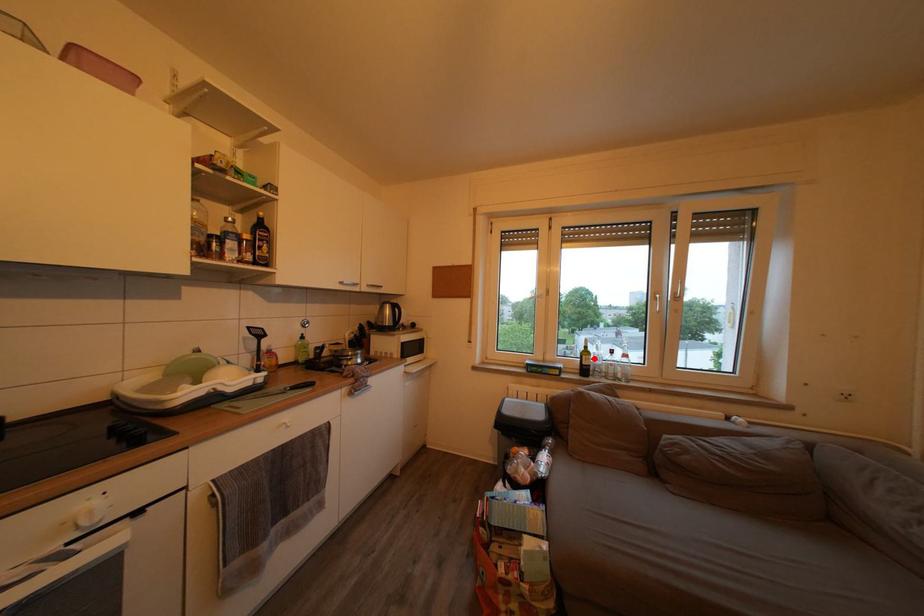
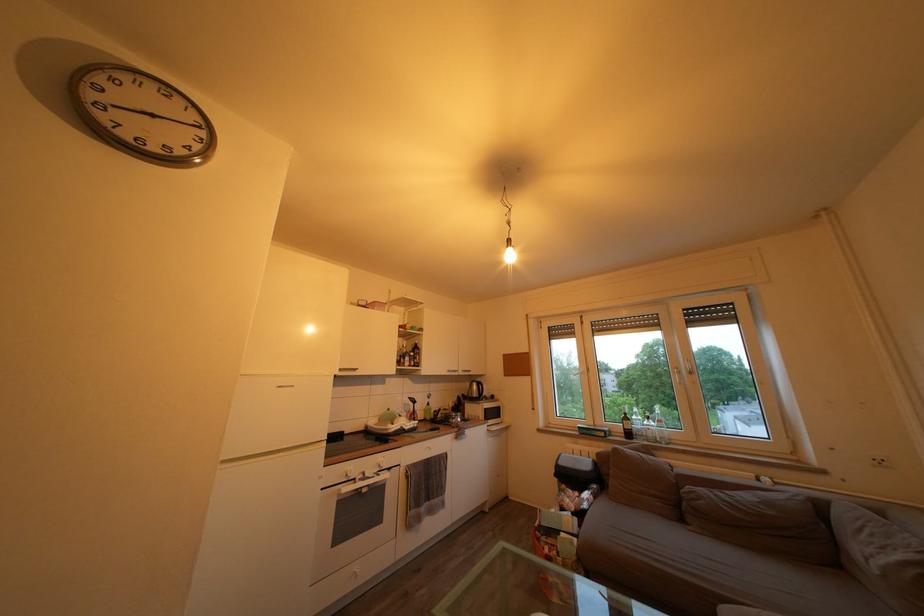
Question: I am providing you with two images of the same scene from different viewpoints. A red point is marked on the first image. Can you still see the location of the red point in image 2?

Choices:
 (A) Yes
 (B) No

Answer: (A)